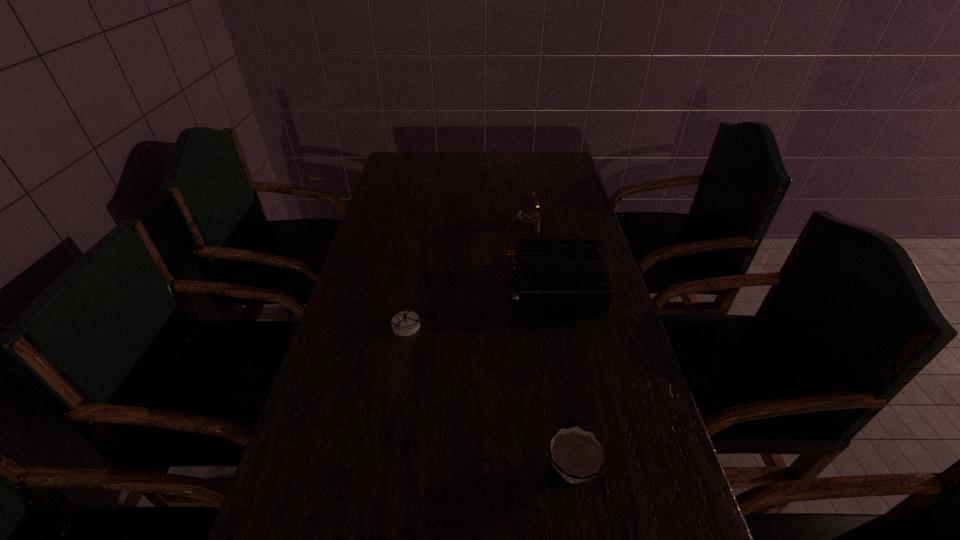
Where is `the farther compass`? The width and height of the screenshot is (960, 540). the farther compass is located at coordinates (528, 218).

The image size is (960, 540). Find the location of `the right compass`. the right compass is located at coordinates (528, 218).

Image resolution: width=960 pixels, height=540 pixels. I want to click on router, so click(x=552, y=276).

At what (x,y) coordinates should I click in order to perform the action: click on cup. Please return your answer as a coordinate pair (x, y). The height and width of the screenshot is (540, 960). Looking at the image, I should click on (578, 456).

Find the location of a particular element. This screenshot has width=960, height=540. the left compass is located at coordinates (405, 323).

The height and width of the screenshot is (540, 960). Find the location of `the leftmost object`. the leftmost object is located at coordinates (405, 323).

At what (x,y) coordinates should I click in order to perform the action: click on free space located with the dial facing the tallest object. Please return your answer as a coordinate pair (x, y). The image size is (960, 540). Looking at the image, I should click on (496, 221).

Where is `free space located with the dial facing the tallest object`? free space located with the dial facing the tallest object is located at coordinates (469, 221).

You are a GUI agent. You are given a task and a screenshot of the screen. Output one action in this format:
    pyautogui.click(x=<x>, y=<y>)
    Task: Click on the free space located with the dial facing the tallest object
    
    Given the screenshot: What is the action you would take?
    pyautogui.click(x=479, y=221)

You are a GUI agent. You are given a task and a screenshot of the screen. Output one action in this format:
    pyautogui.click(x=<x>, y=<y>)
    Task: Click on the vacant position located 0.150m on the back panel of the router
    The image size is (960, 540).
    Given the screenshot: What is the action you would take?
    pyautogui.click(x=455, y=286)